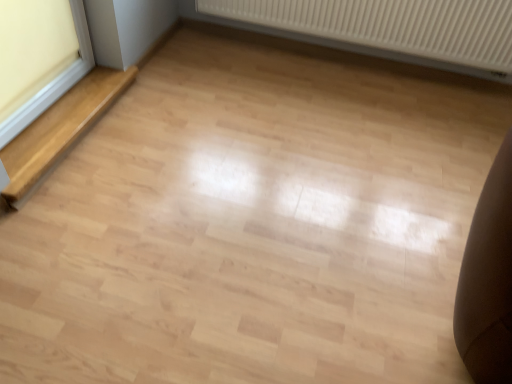
Question: Does light wood stairwell at left have a greater width compared to white plastic window frame at left?

Choices:
 (A) no
 (B) yes

Answer: (B)

Question: Does light wood stairwell at left touch white plastic window frame at left?

Choices:
 (A) no
 (B) yes

Answer: (A)

Question: Considering the relative sizes of light wood stairwell at left and white plastic window frame at left in the image provided, is light wood stairwell at left thinner than white plastic window frame at left?

Choices:
 (A) yes
 (B) no

Answer: (B)

Question: Considering the relative positions of light wood stairwell at left and white plastic window frame at left in the image provided, is light wood stairwell at left to the left of white plastic window frame at left from the viewer's perspective?

Choices:
 (A) no
 (B) yes

Answer: (A)

Question: Would you say white plastic window frame at left is part of light wood stairwell at left's contents?

Choices:
 (A) no
 (B) yes

Answer: (A)

Question: In terms of size, does white plastic window frame at left appear bigger or smaller than light wood stairwell at left?

Choices:
 (A) big
 (B) small

Answer: (B)

Question: Does point (88, 54) appear closer or farther from the camera than point (73, 105)?

Choices:
 (A) farther
 (B) closer

Answer: (A)

Question: In terms of width, does white plastic window frame at left look wider or thinner when compared to light wood stairwell at left?

Choices:
 (A) wide
 (B) thin

Answer: (B)

Question: Would you say white plastic window frame at left is to the left or to the right of light wood stairwell at left in the picture?

Choices:
 (A) right
 (B) left

Answer: (B)

Question: Is point (15, 122) closer or farther from the camera than point (496, 23)?

Choices:
 (A) closer
 (B) farther

Answer: (A)

Question: From a real-world perspective, is white plastic window frame at left positioned above or below white ribbed radiator at upper center?

Choices:
 (A) above
 (B) below

Answer: (A)

Question: In the image, is white plastic window frame at left positioned in front of or behind white ribbed radiator at upper center?

Choices:
 (A) front
 (B) behind

Answer: (A)

Question: Based on their positions, is white plastic window frame at left located to the left or right of white ribbed radiator at upper center?

Choices:
 (A) left
 (B) right

Answer: (A)

Question: In terms of width, does light wood stairwell at left look wider or thinner when compared to white ribbed radiator at upper center?

Choices:
 (A) wide
 (B) thin

Answer: (A)

Question: Which is correct: light wood stairwell at left is inside white ribbed radiator at upper center, or outside of it?

Choices:
 (A) inside
 (B) outside

Answer: (B)